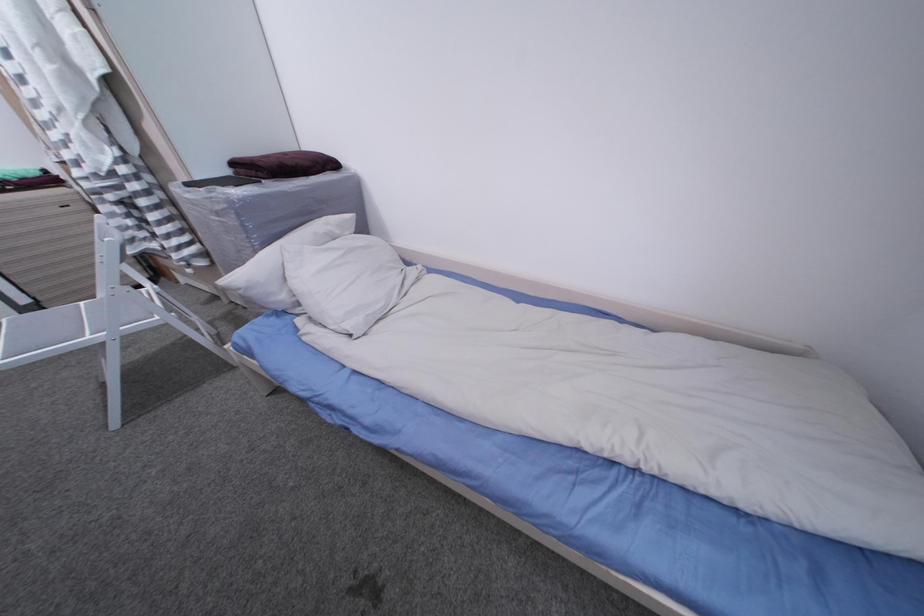
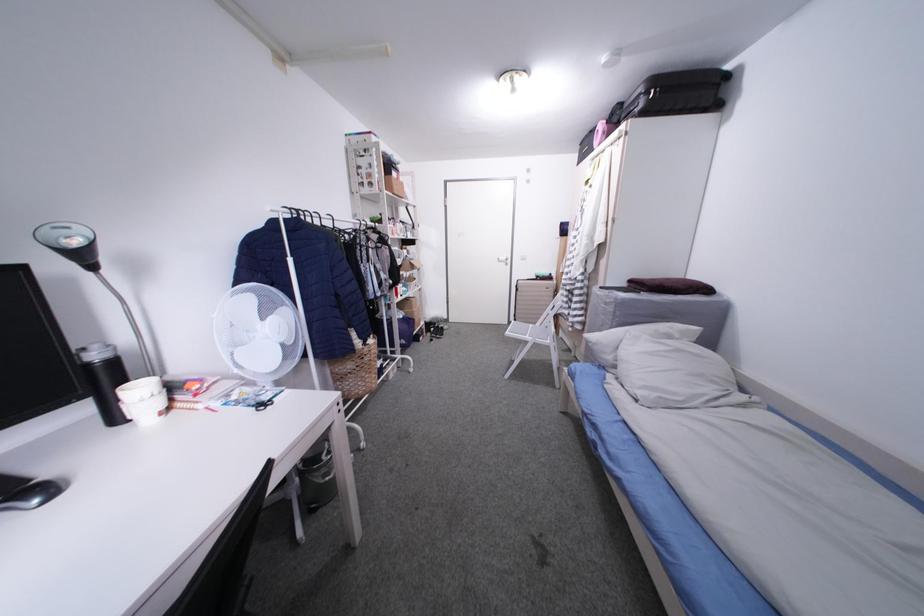
Question: How did the camera likely rotate?

Choices:
 (A) Left
 (B) Right
 (C) Up
 (D) Down

Answer: (A)